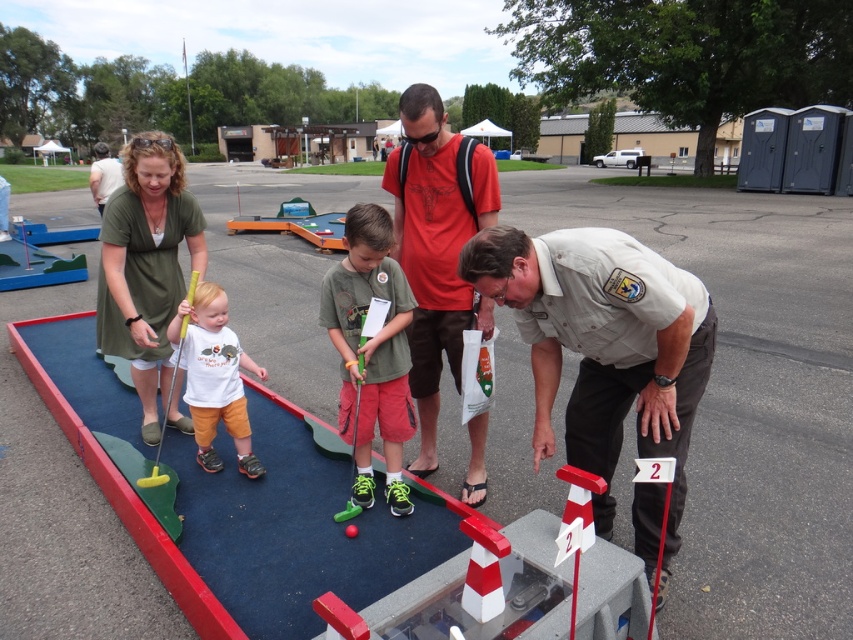
Which is in front, point (604, 513) or point (416, 332)?

Positioned in front is point (604, 513).

Does khaki uniform at center have a greater width compared to red cotton t-shirt at center?

Yes.

Does point (610, 310) lie behind point (462, 145)?

No, (610, 310) is closer to viewer.

Identify the location of khaki uniform at center. The image size is (853, 640). (604, 346).

Which of these two, khaki uniform at center or white cotton shirt at center, stands taller?

khaki uniform at center

Is khaki uniform at center taller than white cotton shirt at center?

Correct, khaki uniform at center is much taller as white cotton shirt at center.

Which is in front, point (669, 570) or point (250, 458)?

Point (669, 570) is in front.

Locate an element on the screen. This screenshot has height=640, width=853. khaki uniform at center is located at coordinates (604, 346).

In the scene shown: Who is higher up, matte green dress at upper left or white cotton shirt at center?

matte green dress at upper left is higher up.

Can you confirm if matte green dress at upper left is bigger than white cotton shirt at center?

Yes, matte green dress at upper left is bigger than white cotton shirt at center.

Identify the location of matte green dress at upper left. (566, 324).